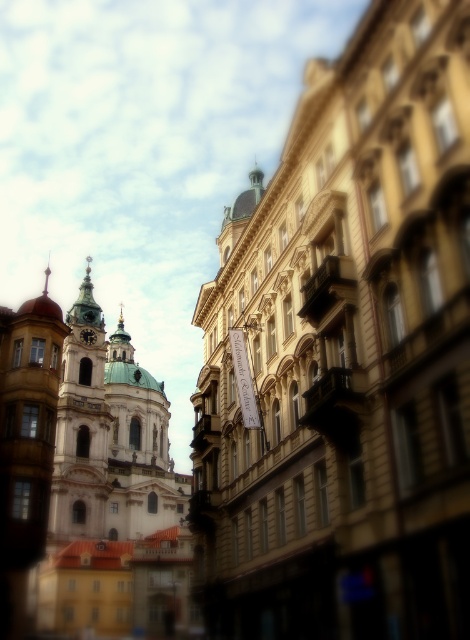
Question: Is golden stone tower at left to the right of gold metallic clock at center-left from the viewer's perspective?

Choices:
 (A) yes
 (B) no

Answer: (A)

Question: Does golden stone tower at left have a lesser width compared to gold metallic clock at center-left?

Choices:
 (A) no
 (B) yes

Answer: (A)

Question: Is golden stone tower at left to the right of gold metallic clock at center-left from the viewer's perspective?

Choices:
 (A) yes
 (B) no

Answer: (A)